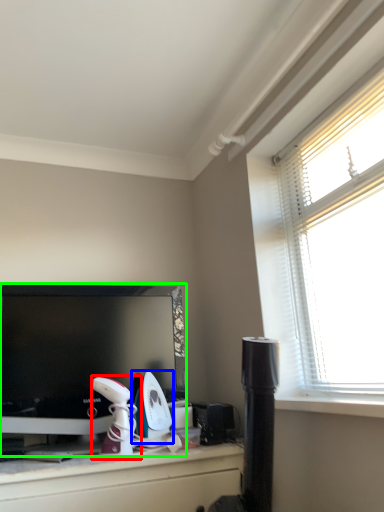
Question: Estimate the real-world distances between objects in this image. Which object is closer to appliance (highlighted by a red box), appliance (highlighted by a blue box) or television (highlighted by a green box)?

Choices:
 (A) appliance
 (B) television

Answer: (A)